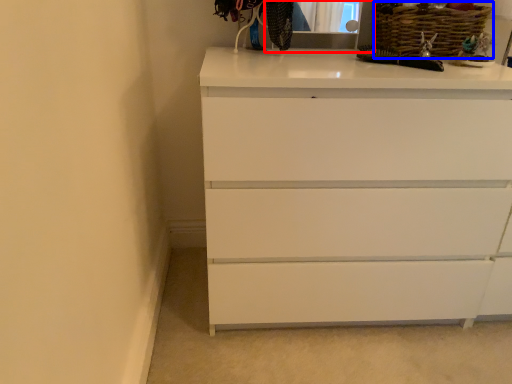
Question: Which object appears closest to the camera in this image, medicine cabinet (highlighted by a red box) or basket (highlighted by a blue box)?

Choices:
 (A) medicine cabinet
 (B) basket

Answer: (A)